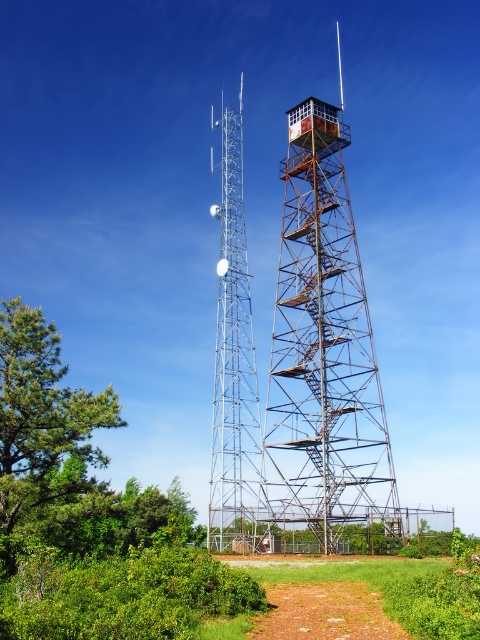
Question: Can you confirm if silver metallic tower at center is bigger than brown dirt path at lower center?

Choices:
 (A) no
 (B) yes

Answer: (B)

Question: Is rusty metal fire tower at center bigger than brown dirt path at lower center?

Choices:
 (A) yes
 (B) no

Answer: (A)

Question: Which point is farther to the camera?

Choices:
 (A) rusty metal fire tower at center
 (B) brown dirt path at lower center

Answer: (A)

Question: Which is nearer to the rusty metal fire tower at center?

Choices:
 (A) silver metallic tower at center
 (B) brown dirt path at lower center

Answer: (A)

Question: Does rusty metal fire tower at center come behind brown dirt path at lower center?

Choices:
 (A) no
 (B) yes

Answer: (B)

Question: Which point appears closest to the camera in this image?

Choices:
 (A) (372, 612)
 (B) (226, 387)
 (C) (291, 492)

Answer: (A)